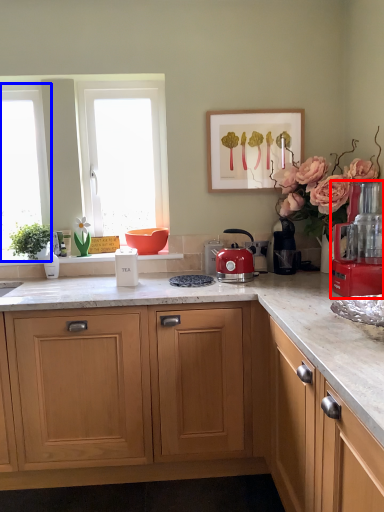
Question: Among these objects, which one is farthest to the camera, kitchen appliance (highlighted by a red box) or window (highlighted by a blue box)?

Choices:
 (A) kitchen appliance
 (B) window

Answer: (B)